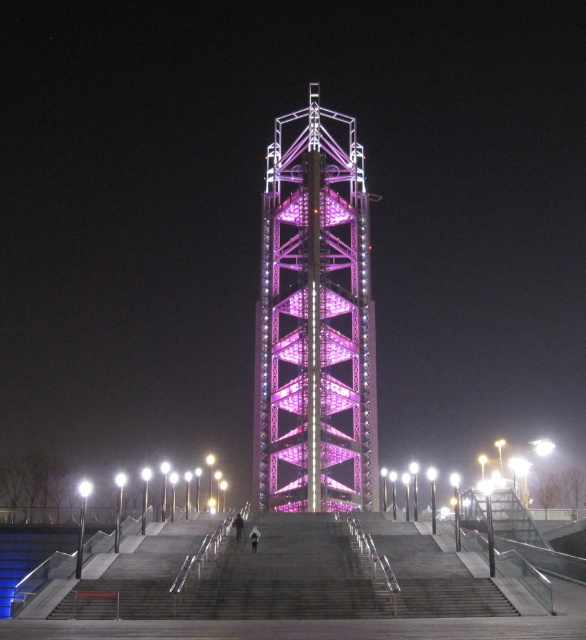
You are standing at the base of the gray concrete stairs at center and want to walk towards the purple metallic bell tower at center. Which direction should you move to get closer to the tower?

You should move forward towards the purple metallic bell tower at center because it is closer to you than the gray concrete stairs at center, which are behind you.

You are an architect evaluating the design of the pink metallic tower at center and the gray concrete stairs at center. Which object has a greater width according to the structural measurements?

The pink metallic tower at center has a greater width than the gray concrete stairs at center.

You are standing at the base of the pink metallic tower at center and want to reach the top of the gray concrete stairs at center. According to the scene description, which direction should you move to ascend towards the stairs?

The pink metallic tower at center is located below the gray concrete stairs at center, so you should move upward towards the stairs to reach the top.